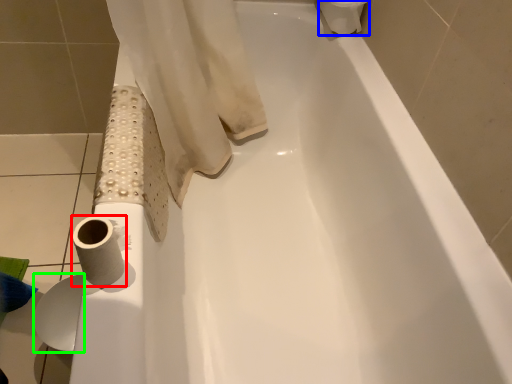
Question: Considering the real-world distances, which object is closest to toilet paper (highlighted by a red box)? toilet paper (highlighted by a blue box) or toilet paper (highlighted by a green box).

Choices:
 (A) toilet paper
 (B) toilet paper

Answer: (B)